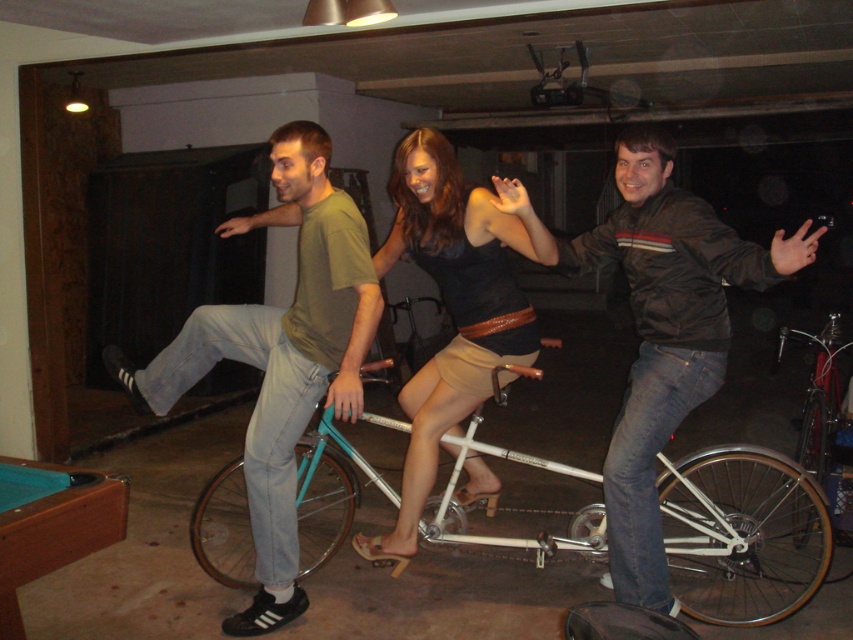
Based on the photo, you are moving a white metallic bicycle at center and a dark brown leather jacket at center into a storage room with limited space. Based on their sizes, which item should you place first to optimize space efficiency?

The white metallic bicycle at center is larger in size than the dark brown leather jacket at center, so you should place the white metallic bicycle at center first to optimize space efficiency.

You are trying to move the white metallic bicycle at center and the dark brown leather jacket at center through a narrow doorway that is 1.5 meters wide. Based on their widths, can both items fit through the doorway simultaneously?

The white metallic bicycle at center might be wider than dark brown leather jacket at center. Therefore, it is uncertain if both items can fit through the 1.5 meter wide doorway simultaneously without overlapping or adjusting their positions.

You are a delivery person carrying a package that requires a clear path of 3 meters to maneuver safely. You are standing in front of the white metallic bicycle at center. Can you safely move past the bicycle with your package?

The distance between you and the white metallic bicycle at center is 2.99 meters, which is just shy of the required 3 meters needed for safe maneuvering. Therefore, it might be risky to attempt moving past the bicycle with the package as there isn